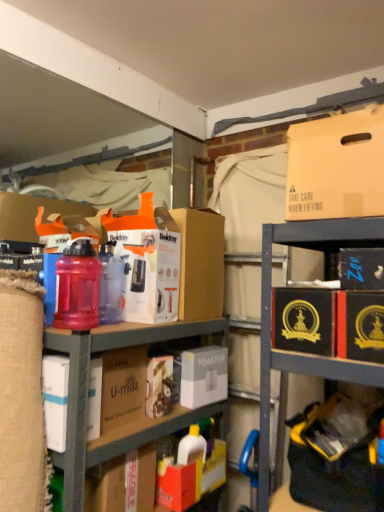
Where is `gold embossed box at right, which is the 2th cardboard box from back to front`? The height and width of the screenshot is (512, 384). gold embossed box at right, which is the 2th cardboard box from back to front is located at coordinates (304, 320).

Measure the distance between point (x=211, y=222) and camera.

The depth of point (x=211, y=222) is 5.42 feet.

Measure the distance between point (80, 240) and camera.

A distance of 5.31 feet exists between point (80, 240) and camera.

The image size is (384, 512). In order to click on matte plastic bottles at center in this screenshot , I will do `click(132, 416)`.

Where is `black cardboard box at upper right, the third storage box ordered from the bottom`? The image size is (384, 512). black cardboard box at upper right, the third storage box ordered from the bottom is located at coordinates (361, 269).

This screenshot has height=512, width=384. Identify the location of gold embossed box at right, which is the 2th cardboard box from back to front. (304, 320).

Is gold embossed box at right, placed as the second cardboard box when sorted from left to right, next to orange matte cardboard box at center, the 1th cardboard box when ordered from left to right, and touching it?

No, gold embossed box at right, placed as the second cardboard box when sorted from left to right, is not in contact with orange matte cardboard box at center, the 1th cardboard box when ordered from left to right.

Is gold embossed box at right, which is the 2th cardboard box from back to front, positioned beyond the bounds of orange matte cardboard box at center, the 1th cardboard box when ordered from left to right?

Yes, gold embossed box at right, which is the 2th cardboard box from back to front, is not within orange matte cardboard box at center, the 1th cardboard box when ordered from left to right.

Between gold embossed box at right, placed as the second cardboard box when sorted from left to right, and orange matte cardboard box at center, which appears as the second cardboard box when viewed from the right, which one is positioned behind?

orange matte cardboard box at center, which appears as the second cardboard box when viewed from the right, is behind.

Considering the sizes of gold embossed box at right, which is the 2th cardboard box from back to front, and orange matte cardboard box at center, which is the second cardboard box from front to back, in the image, is gold embossed box at right, which is the 2th cardboard box from back to front, bigger or smaller than orange matte cardboard box at center, which is the second cardboard box from front to back,?

Clearly, gold embossed box at right, which is the 2th cardboard box from back to front, is smaller in size than orange matte cardboard box at center, which is the second cardboard box from front to back.

Is translucent plastic water bottle at left closer to the viewer compared to white matte toaster at center, which is the third storage box in right-to-left order?

Yes, it is.

How many degrees apart are the facing directions of translucent plastic water bottle at left and white matte toaster at center, which ranks as the 1th storage box in bottom-to-top order?

translucent plastic water bottle at left and white matte toaster at center, which ranks as the 1th storage box in bottom-to-top order, are facing 1.33 degrees away from each other.

Does point (66, 296) appear closer or farther from the camera than point (180, 392)?

Point (66, 296) is closer to the camera than point (180, 392).

From the image's perspective, which object appears higher, translucent plastic water bottle at left or white matte toaster at center, arranged as the 3th storage box when viewed from the top?

translucent plastic water bottle at left.

Considering the sizes of black cardboard box at upper right, the third storage box ordered from the bottom, and matte cardboard box at upper right in the image, is black cardboard box at upper right, the third storage box ordered from the bottom, bigger or smaller than matte cardboard box at upper right?

In the image, black cardboard box at upper right, the third storage box ordered from the bottom, appears to be smaller than matte cardboard box at upper right.

From the image's perspective, which is below, black cardboard box at upper right, the second storage box positioned from the left, or matte cardboard box at upper right?

From the image's view, black cardboard box at upper right, the second storage box positioned from the left, is below.

Between black cardboard box at upper right, which appears as the second storage box when viewed from the right, and matte cardboard box at upper right, which one appears on the right side from the viewer's perspective?

black cardboard box at upper right, which appears as the second storage box when viewed from the right.

Locate an element on the screen. the 2nd storage box to the left of the black cardboard box at lower right, which ranks as the 1th storage box in right-to-left order, starting your count from the anchor is located at coordinates (204, 376).

Is white matte toaster at center, arranged as the 3th storage box when viewed from the top, further to camera compared to black cardboard box at lower right, the second storage box when ordered from bottom to top?

Yes.

Is black cardboard box at lower right, which is counted as the 3th storage box, starting from the left, a part of white matte toaster at center, which is the third storage box in right-to-left order?

Actually, black cardboard box at lower right, which is counted as the 3th storage box, starting from the left, is outside white matte toaster at center, which is the third storage box in right-to-left order.

Which object is closer to the camera taking this photo, black cardboard box at upper right, which appears as the second storage box when viewed from the right, or white matte toaster at center, which ranks as the 1th storage box in bottom-to-top order?

black cardboard box at upper right, which appears as the second storage box when viewed from the right, is more forward.

In the scene shown: Which is more to the right, black cardboard box at upper right, the third storage box ordered from the bottom, or white matte toaster at center, which ranks as the 1th storage box in bottom-to-top order?

black cardboard box at upper right, the third storage box ordered from the bottom, is more to the right.

From the image's perspective, would you say black cardboard box at upper right, the second storage box positioned from the left, is positioned over white matte toaster at center, which is the third storage box in right-to-left order?

Yes.

How distant is black cardboard box at upper right, the third storage box ordered from the bottom, from white matte toaster at center, arranged as the 1th storage box when viewed from the left?

black cardboard box at upper right, the third storage box ordered from the bottom, is 70.01 centimeters away from white matte toaster at center, arranged as the 1th storage box when viewed from the left.

Which is more to the right, matte cardboard box at upper right or black cardboard box at upper right, positioned as the first storage box in top-to-bottom order?

Positioned to the right is black cardboard box at upper right, positioned as the first storage box in top-to-bottom order.

Is matte cardboard box at upper right facing towards black cardboard box at upper right, the second storage box positioned from the left?

No, matte cardboard box at upper right is not oriented towards black cardboard box at upper right, the second storage box positioned from the left.

From a real-world perspective, is matte cardboard box at upper right above or below black cardboard box at upper right, positioned as the first storage box in top-to-bottom order?

Clearly, from a real-world perspective, matte cardboard box at upper right is above black cardboard box at upper right, positioned as the first storage box in top-to-bottom order.

Is white matte toaster at center, which ranks as the 1th storage box in bottom-to-top order, wider than orange matte cardboard box at center, arranged as the first cardboard box when viewed from the back?

No, white matte toaster at center, which ranks as the 1th storage box in bottom-to-top order, is not wider than orange matte cardboard box at center, arranged as the first cardboard box when viewed from the back.

Is point (185, 396) farther from viewer compared to point (181, 255)?

No, it is not.

Consider the image. How distant is white matte toaster at center, arranged as the 1th storage box when viewed from the left, from orange matte cardboard box at center, the 1th cardboard box when ordered from left to right?

white matte toaster at center, arranged as the 1th storage box when viewed from the left, and orange matte cardboard box at center, the 1th cardboard box when ordered from left to right, are 11.04 inches apart.

The height and width of the screenshot is (512, 384). What are the coordinates of `cardboard box below the orange matte cardboard box at center, arranged as the first cardboard box when viewed from the back (from a real-world perspective)` in the screenshot? It's located at (304, 320).

You are a GUI agent. You are given a task and a screenshot of the screen. Output one action in this format:
    pyautogui.click(x=<x>, y=<y>)
    Task: Click on the bottle that is above the white matte toaster at center, which is the third storage box in right-to-left order (from a real-world perspective)
    The width and height of the screenshot is (384, 512).
    Given the screenshot: What is the action you would take?
    pyautogui.click(x=77, y=287)

From the image, which object appears to be nearer to orange matte cardboard box at center, the 1th cardboard box when ordered from left to right, white matte toaster at center, which ranks as the 1th storage box in bottom-to-top order, or black cardboard box at lower right, which is counted as the 3th storage box, starting from the left?

Among the two, white matte toaster at center, which ranks as the 1th storage box in bottom-to-top order, is located nearer to orange matte cardboard box at center, the 1th cardboard box when ordered from left to right.

Looking at the image, which one is located closer to white matte toaster at center, which is the third storage box in right-to-left order, matte cardboard box at upper right or translucent plastic water bottle at left?

translucent plastic water bottle at left is positioned closer to the anchor white matte toaster at center, which is the third storage box in right-to-left order.

Estimate the real-world distances between objects in this image. Which object is closer to gold embossed box at right, the first cardboard box positioned from the right, matte plastic bottles at center or black cardboard box at upper right, which appears as the second storage box when viewed from the right?

black cardboard box at upper right, which appears as the second storage box when viewed from the right, is positioned closer to the anchor gold embossed box at right, the first cardboard box positioned from the right.

From the image, which object appears to be farther from black cardboard box at lower right, placed as the 2th storage box when sorted from top to bottom, orange matte cardboard box at center, the 1th cardboard box when ordered from left to right, or matte plastic bottles at center?

matte plastic bottles at center is positioned further to the anchor black cardboard box at lower right, placed as the 2th storage box when sorted from top to bottom.

Looking at the image, which one is located further to matte plastic bottles at center, gold embossed box at right, which is the 2th cardboard box from back to front, or translucent plastic water bottle at left?

gold embossed box at right, which is the 2th cardboard box from back to front, is further to matte plastic bottles at center.

Which object lies further to the anchor point white matte toaster at center, which ranks as the 1th storage box in bottom-to-top order, translucent plastic water bottle at left or black cardboard box at lower right, which ranks as the 1th storage box in right-to-left order?

black cardboard box at lower right, which ranks as the 1th storage box in right-to-left order, lies further to white matte toaster at center, which ranks as the 1th storage box in bottom-to-top order, than the other object.

Estimate the real-world distances between objects in this image. Which object is closer to matte plastic bottles at center, gold embossed box at right, which appears as the first cardboard box when viewed from the front, or white matte toaster at center, which ranks as the 1th storage box in bottom-to-top order?

white matte toaster at center, which ranks as the 1th storage box in bottom-to-top order, lies closer to matte plastic bottles at center than the other object.

From the image, which object appears to be farther from translucent plastic water bottle at left, black cardboard box at lower right, placed as the 2th storage box when sorted from top to bottom, or matte cardboard box at upper right?

black cardboard box at lower right, placed as the 2th storage box when sorted from top to bottom, is further to translucent plastic water bottle at left.

Identify the location of shelf situated between translucent plastic water bottle at left and black cardboard box at upper right, which appears as the second storage box when viewed from the right, from left to right. (132, 416).

In order to click on storage box between matte cardboard box at upper right and black cardboard box at lower right, which ranks as the 1th storage box in right-to-left order, in the vertical direction in this screenshot , I will do `click(361, 269)`.

Where is `cardboard box between matte plastic bottles at center and gold embossed box at right, which is the 2th cardboard box from back to front, in the horizontal direction`? This screenshot has width=384, height=512. cardboard box between matte plastic bottles at center and gold embossed box at right, which is the 2th cardboard box from back to front, in the horizontal direction is located at coordinates (198, 260).

The width and height of the screenshot is (384, 512). Find the location of `storage box between white matte toaster at center, which is the third storage box in right-to-left order, and black cardboard box at lower right, which ranks as the 1th storage box in right-to-left order, from left to right`. storage box between white matte toaster at center, which is the third storage box in right-to-left order, and black cardboard box at lower right, which ranks as the 1th storage box in right-to-left order, from left to right is located at coordinates (361, 269).